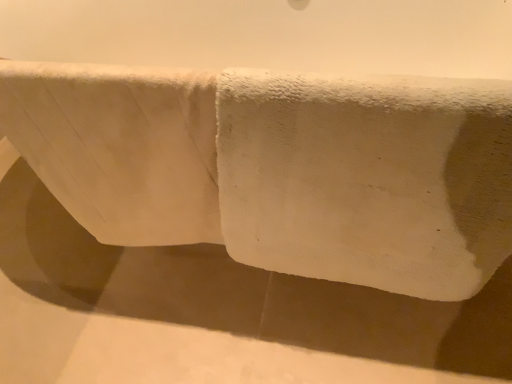
Question: Is white soft towel at center spatially inside white fluffy towel at upper center, or outside of it?

Choices:
 (A) outside
 (B) inside

Answer: (A)

Question: Is white soft towel at center bigger or smaller than white fluffy towel at upper center?

Choices:
 (A) big
 (B) small

Answer: (A)

Question: From a real-world perspective, is white soft towel at center above or below white fluffy towel at upper center?

Choices:
 (A) above
 (B) below

Answer: (B)

Question: Relative to white soft towel at center, is white fluffy towel at upper center in front or behind?

Choices:
 (A) front
 (B) behind

Answer: (B)

Question: From a real-world perspective, is white fluffy towel at upper center positioned above or below white soft towel at center?

Choices:
 (A) below
 (B) above

Answer: (B)

Question: Visually, is white fluffy towel at upper center positioned to the left or to the right of white soft towel at center?

Choices:
 (A) right
 (B) left

Answer: (B)

Question: Considering the positions of point (144, 236) and point (412, 228), is point (144, 236) closer or farther from the camera than point (412, 228)?

Choices:
 (A) farther
 (B) closer

Answer: (A)